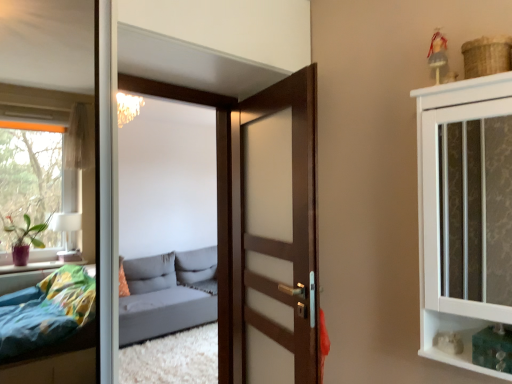
What is the approximate height of wooden door at center?

5.26 feet.

What do you see at coordinates (168, 337) in the screenshot? The height and width of the screenshot is (384, 512). I see `gray fabric studio couch at center` at bounding box center [168, 337].

You are a GUI agent. You are given a task and a screenshot of the screen. Output one action in this format:
    pyautogui.click(x=<x>, y=<y>)
    Task: Click on the white textured cabinet at upper right
    The image size is (512, 384).
    Given the screenshot: What is the action you would take?
    pyautogui.click(x=423, y=185)

From a real-world perspective, is wooden door at center on white textured cabinet at upper right?

No, from a real-world perspective, wooden door at center is not on top of white textured cabinet at upper right.

From the image's perspective, is wooden door at center located above or below white textured cabinet at upper right?

Based on their image positions, wooden door at center is located beneath white textured cabinet at upper right.

Is wooden door at center turned away from white textured cabinet at upper right?

wooden door at center does not have its back to white textured cabinet at upper right.

Can you confirm if wooden door at center is wider than white textured cabinet at upper right?

Incorrect, the width of wooden door at center does not surpass that of white textured cabinet at upper right.

Find the location of a particular element. This screenshot has width=512, height=384. door that is above the gray fabric studio couch at center (from a real-world perspective) is located at coordinates (275, 234).

Considering the sizes of objects wooden door at center and gray fabric studio couch at center in the image provided, who is wider, wooden door at center or gray fabric studio couch at center?

With larger width is gray fabric studio couch at center.

From the image's perspective, which object appears higher, wooden door at center or gray fabric studio couch at center?

wooden door at center is shown above in the image.

Consider the image. Based on their sizes in the image, would you say wooden door at center is bigger or smaller than gray fabric studio couch at center?

Clearly, wooden door at center is smaller in size than gray fabric studio couch at center.

Measure the distance from gray fabric studio couch at center to wooden door at center.

gray fabric studio couch at center is 6.59 feet from wooden door at center.

Do you think gray fabric studio couch at center is within wooden door at center, or outside of it?

gray fabric studio couch at center is not inside wooden door at center, it's outside.

What's the angular difference between gray fabric studio couch at center and wooden door at center's facing directions?

The angle between the facing direction of gray fabric studio couch at center and the facing direction of wooden door at center is 105 degrees.

Is gray fabric studio couch at center positioned far away from wooden door at center?

gray fabric studio couch at center is far away from wooden door at center.

Could you tell me if white textured cabinet at upper right is facing gray fabric studio couch at center?

No, white textured cabinet at upper right does not turn towards gray fabric studio couch at center.

Which object is positioned more to the left, white textured cabinet at upper right or gray fabric studio couch at center?

From the viewer's perspective, gray fabric studio couch at center appears more on the left side.

Which is behind, white textured cabinet at upper right or gray fabric studio couch at center?

Positioned behind is gray fabric studio couch at center.

Considering the sizes of objects white textured cabinet at upper right and wooden door at center in the image provided, who is bigger, white textured cabinet at upper right or wooden door at center?

With larger size is white textured cabinet at upper right.

Would you say white textured cabinet at upper right is outside wooden door at center?

Yes, white textured cabinet at upper right is located beyond the bounds of wooden door at center.

Does white textured cabinet at upper right turn towards wooden door at center?

No, white textured cabinet at upper right does not turn towards wooden door at center.

From a real-world perspective, is gray fabric studio couch at center below white textured cabinet at upper right?

Yes, from a real-world perspective, gray fabric studio couch at center is under white textured cabinet at upper right.

Measure the distance from gray fabric studio couch at center to white textured cabinet at upper right.

They are 9.95 feet apart.

Where is `studio couch behind the white textured cabinet at upper right`? The height and width of the screenshot is (384, 512). studio couch behind the white textured cabinet at upper right is located at coordinates (168, 337).

From the image's perspective, between gray fabric studio couch at center and white textured cabinet at upper right, which one is located above?

From the image's view, white textured cabinet at upper right is above.

Find the location of a particular element. door located behind the white textured cabinet at upper right is located at coordinates (275, 234).

I want to click on studio couch located underneath the wooden door at center (from a real-world perspective), so click(x=168, y=337).

Looking at the image, which one is located closer to wooden door at center, gray fabric studio couch at center or white textured cabinet at upper right?

Based on the image, white textured cabinet at upper right appears to be nearer to wooden door at center.

Looking at the image, which one is located further to wooden door at center, white textured cabinet at upper right or gray fabric studio couch at center?

gray fabric studio couch at center is positioned further to the anchor wooden door at center.

Looking at the image, which one is located further to white textured cabinet at upper right, wooden door at center or gray fabric studio couch at center?

The object further to white textured cabinet at upper right is gray fabric studio couch at center.

Which object lies further to the anchor point gray fabric studio couch at center, wooden door at center or white textured cabinet at upper right?

Based on the image, white textured cabinet at upper right appears to be further to gray fabric studio couch at center.

Looking at the image, which one is located further to gray fabric studio couch at center, white textured cabinet at upper right or wooden door at center?

white textured cabinet at upper right is positioned further to the anchor gray fabric studio couch at center.

When comparing their distances from white textured cabinet at upper right, does gray fabric studio couch at center or wooden door at center seem closer?

Based on the image, wooden door at center appears to be nearer to white textured cabinet at upper right.

The height and width of the screenshot is (384, 512). Find the location of `door between white textured cabinet at upper right and gray fabric studio couch at center in the front-back direction`. door between white textured cabinet at upper right and gray fabric studio couch at center in the front-back direction is located at coordinates (275, 234).